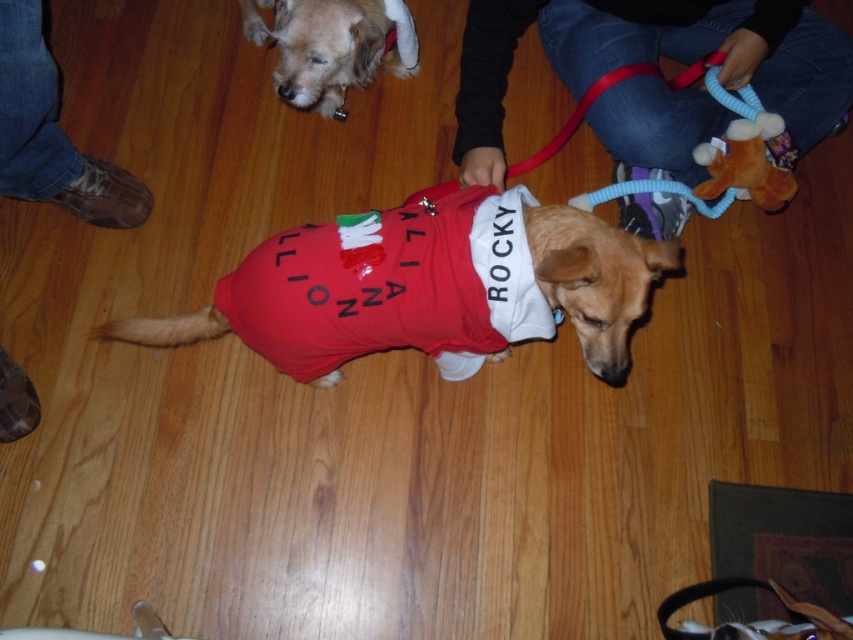
Who is lower down, shiny red fabric dog at center or brown leather boot at lower left?

shiny red fabric dog at center

Is point (286, 272) positioned after point (49, 132)?

No, it is not.

Between point (561, 234) and point (57, 202), which one is positioned in front?

Point (561, 234) is in front.

Locate an element on the screen. This screenshot has height=640, width=853. shiny red fabric dog at center is located at coordinates (428, 288).

Can you confirm if brown leather boot at lower left is shorter than shiny brown fur at center?

Incorrect, brown leather boot at lower left's height does not fall short of shiny brown fur at center's.

Who is more forward, (64, 150) or (833, 621)?

Point (833, 621) is in front.

The width and height of the screenshot is (853, 640). What are the coordinates of `brown leather boot at lower left` in the screenshot? It's located at (51, 134).

Looking at this image, can you confirm if jeans at center is bigger than brown leather boot at lower left?

Yes.

Where is `jeans at center`? The height and width of the screenshot is (640, 853). jeans at center is located at coordinates (653, 60).